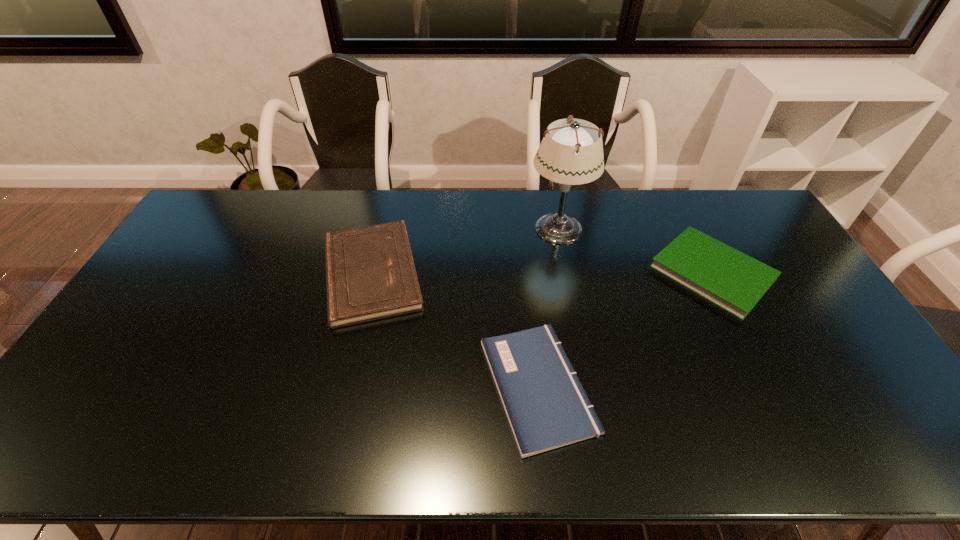
Where is `free region located 0.400m on the left of the shortest paperback book`? The width and height of the screenshot is (960, 540). free region located 0.400m on the left of the shortest paperback book is located at coordinates (324, 386).

Locate an element on the screen. The height and width of the screenshot is (540, 960). lampshade located at the far edge is located at coordinates (570, 154).

Find the location of `paperback book that is at the far edge`. paperback book that is at the far edge is located at coordinates (370, 274).

Find the location of `object that is at the near edge`. object that is at the near edge is located at coordinates (546, 406).

You are a GUI agent. You are given a task and a screenshot of the screen. Output one action in this format:
    pyautogui.click(x=<x>, y=<y>)
    Task: Click on the object that is at the right edge
    Image resolution: width=960 pixels, height=540 pixels.
    Given the screenshot: What is the action you would take?
    coord(730,279)

The image size is (960, 540). In the image, there is a desktop. In order to click on vacant space at the far edge in this screenshot , I will do `click(639, 229)`.

In the image, there is a desktop. Identify the location of vacant space at the near edge. Image resolution: width=960 pixels, height=540 pixels. (580, 443).

Where is `blank space at the left edge of the desktop`? The width and height of the screenshot is (960, 540). blank space at the left edge of the desktop is located at coordinates (69, 403).

In the image, there is a desktop. Where is `vacant area at the right edge`? This screenshot has width=960, height=540. vacant area at the right edge is located at coordinates (835, 327).

At what (x,y) coordinates should I click in order to perform the action: click on free space at the near left corner of the desktop. Please return your answer as a coordinate pair (x, y). The height and width of the screenshot is (540, 960). Looking at the image, I should click on (76, 443).